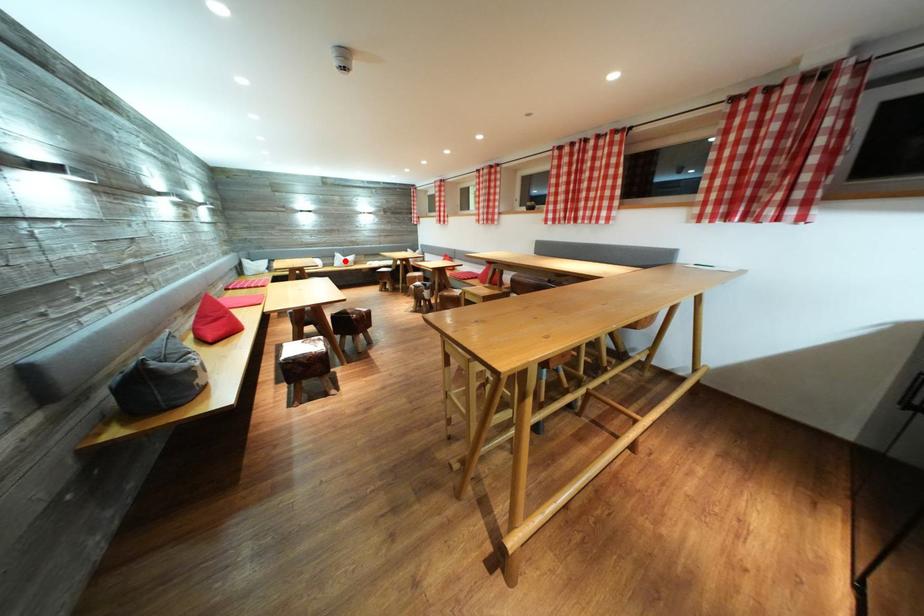
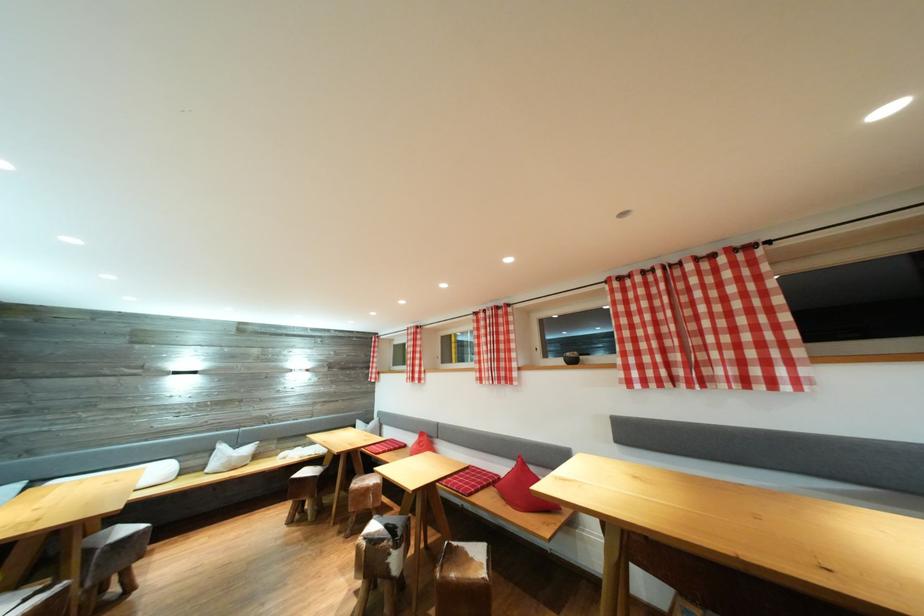
Question: I am providing you with two images of the same scene from different viewpoints. In image1, a red point is highlighted. Considering the same 3D point in image2, which of the following is correct?

Choices:
 (A) It is closer
 (B) It is farther

Answer: (B)